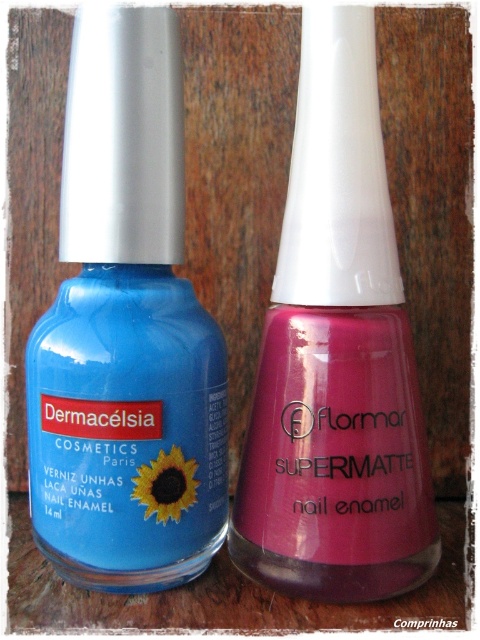
You are a customer looking to pick up the matte pink nail enamel at center from the shelf. Based on the image, will you need to move the matte blue nail enamel at left first?

The matte blue nail enamel at left is closer to the viewer than the matte pink nail enamel at center, so you will need to move the matte blue nail enamel at left first to access the matte pink nail enamel at center.